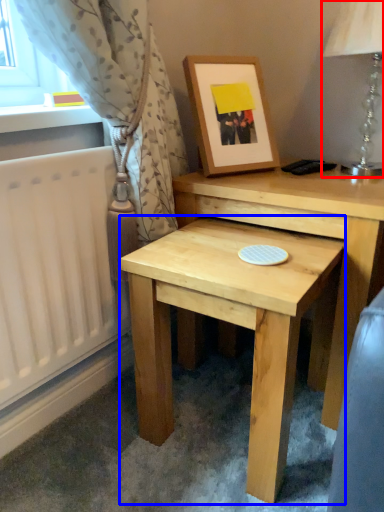
Question: Which object is closer to the camera taking this photo, table lamp (highlighted by a red box) or table (highlighted by a blue box)?

Choices:
 (A) table lamp
 (B) table

Answer: (B)